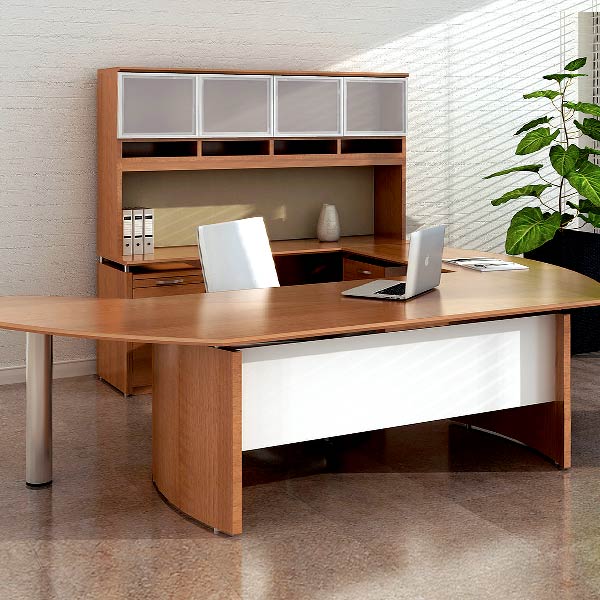
Locate an element on the screen. The height and width of the screenshot is (600, 600). binder is located at coordinates (124, 229), (136, 229), (150, 230).